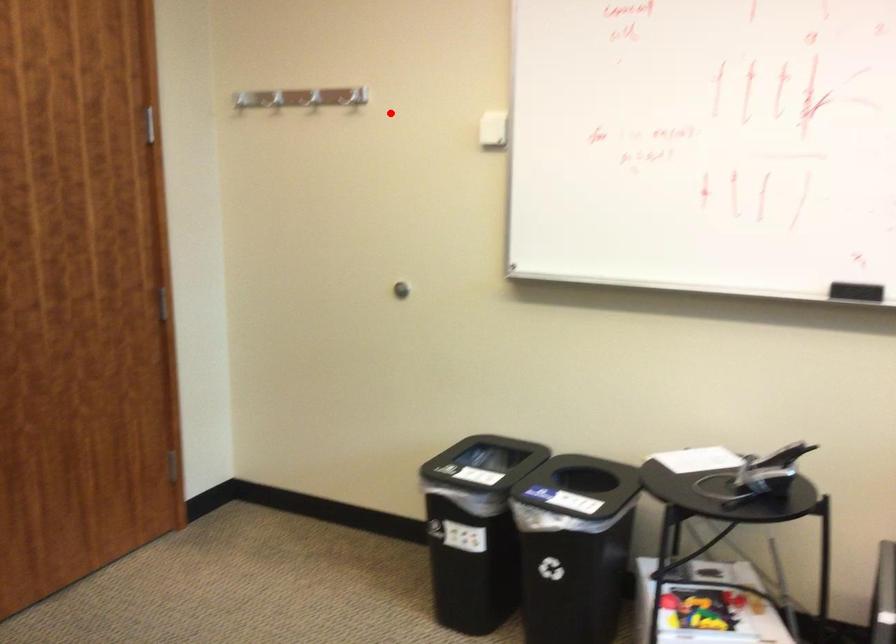
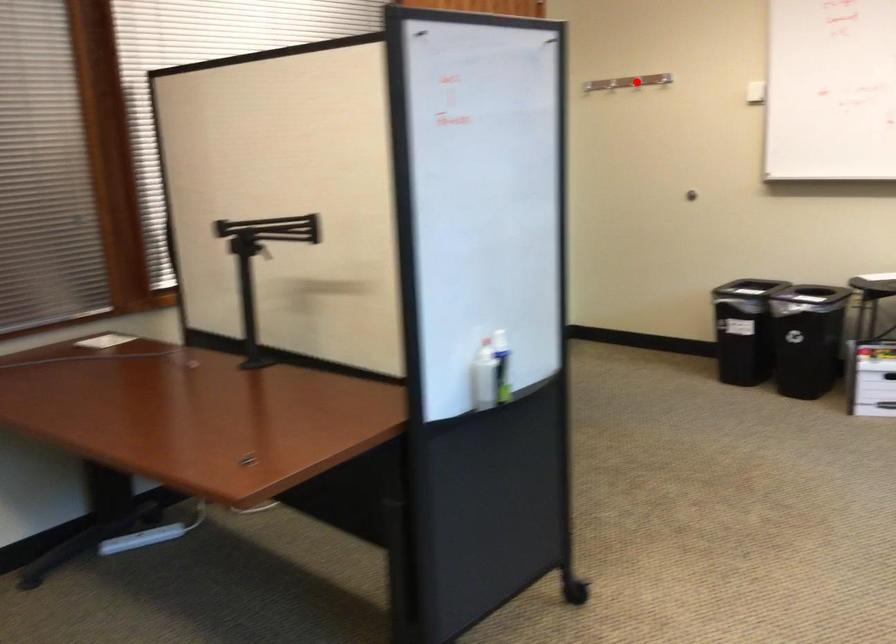
I am providing you with two images of the same scene from different viewpoints. A red point is marked on the first image and another point is marked on the second image. Is the red point in image1 aligned with the point shown in image2?

No